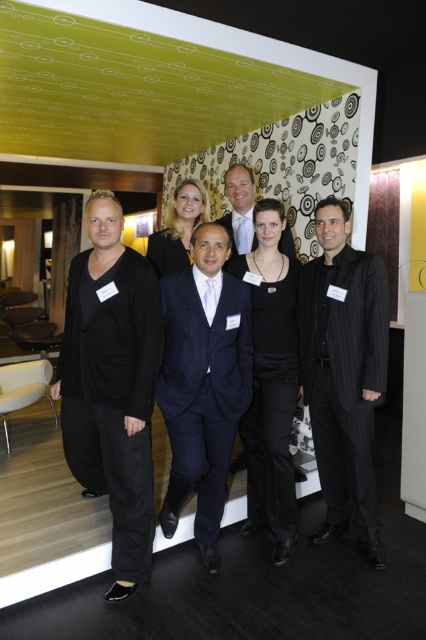
Question: Among these points, which one is farthest from the camera?

Choices:
 (A) (278, 288)
 (B) (345, 260)
 (C) (150, 240)

Answer: (C)

Question: Observing the image, what is the correct spatial positioning of black matte suit at left in reference to matte black dress at center?

Choices:
 (A) right
 (B) left

Answer: (B)

Question: Which point is farther to the camera?

Choices:
 (A) (233, 236)
 (B) (129, 552)

Answer: (A)

Question: Is matte black dress at center positioned in front of matte black suit at center?

Choices:
 (A) yes
 (B) no

Answer: (A)

Question: Which of the following is the closest to the observer?

Choices:
 (A) (247, 500)
 (B) (135, 456)
 (C) (347, 273)
 (D) (229, 392)

Answer: (B)

Question: Is black matte suit at left smaller than matte black dress at center?

Choices:
 (A) yes
 (B) no

Answer: (B)